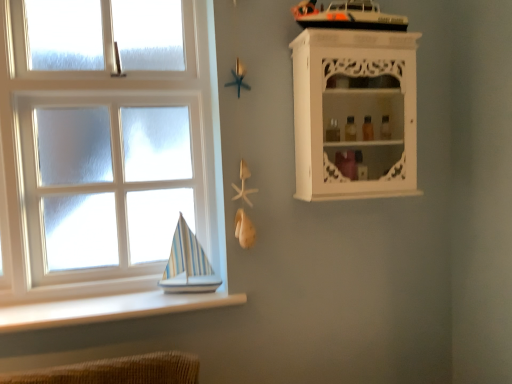
Question: Is white smooth ledge at lower left in front of or behind white carved wood cabinet at upper right in the image?

Choices:
 (A) front
 (B) behind

Answer: (A)

Question: From the image's perspective, is white smooth ledge at lower left positioned above or below white carved wood cabinet at upper right?

Choices:
 (A) below
 (B) above

Answer: (A)

Question: Estimate the real-world distances between objects in this image. Which object is closer to the white carved wood cabinet at upper right?

Choices:
 (A) white smooth ledge at lower left
 (B) white wooden window at lower left

Answer: (B)

Question: Which object is the closest to the white wooden window at lower left?

Choices:
 (A) white carved wood cabinet at upper right
 (B) white smooth ledge at lower left

Answer: (B)